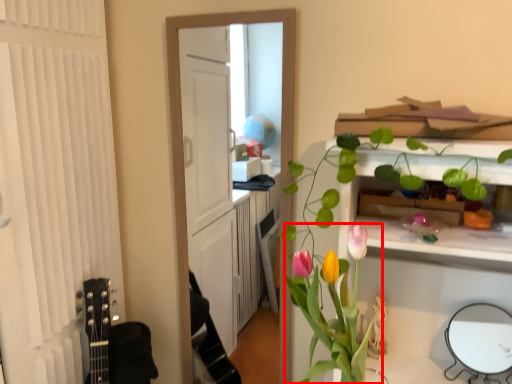
Question: From the image's perspective, what is the correct spatial positioning of floral arrangement (annotated by the red box) in reference to mirror?

Choices:
 (A) above
 (B) below

Answer: (A)